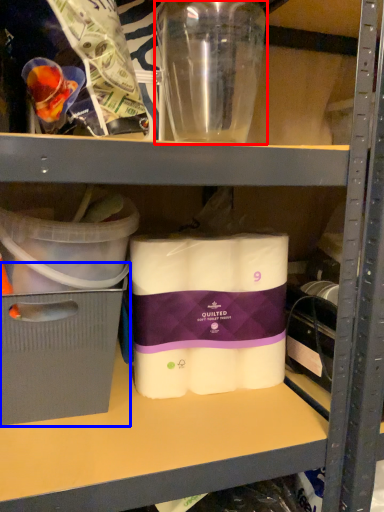
Question: Which object is further to the camera taking this photo, bottle (highlighted by a red box) or storage box (highlighted by a blue box)?

Choices:
 (A) bottle
 (B) storage box

Answer: (B)